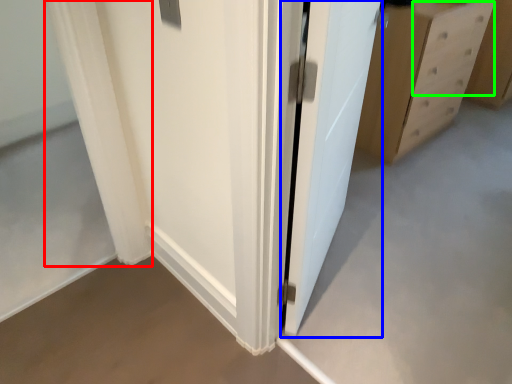
Question: Which is farther away from curtain (highlighted by a red box)? door (highlighted by a blue box) or drawer (highlighted by a green box)?

Choices:
 (A) door
 (B) drawer

Answer: (B)